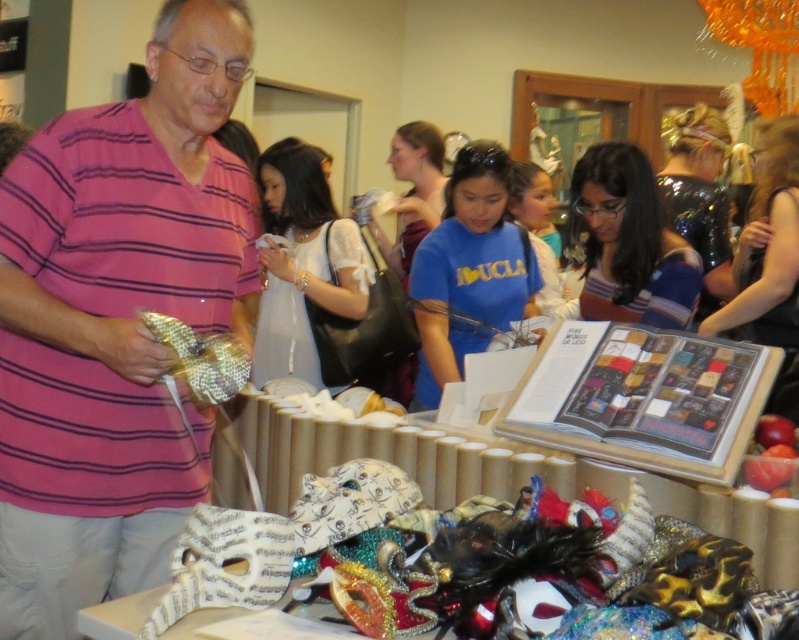
Can you confirm if blue matte t-shirt at center is taller than striped fabric shirt at center?

Indeed, blue matte t-shirt at center has a greater height compared to striped fabric shirt at center.

Find the location of a particular element. The image size is (799, 640). blue matte t-shirt at center is located at coordinates (468, 272).

Image resolution: width=799 pixels, height=640 pixels. In order to click on blue matte t-shirt at center in this screenshot , I will do `click(468, 272)`.

Is white lace dress at center to the right of striped fabric shirt at center from the viewer's perspective?

Incorrect, white lace dress at center is not on the right side of striped fabric shirt at center.

Is white lace dress at center further to the viewer compared to striped fabric shirt at center?

Yes, white lace dress at center is behind striped fabric shirt at center.

Is point (356, 260) positioned after point (625, 314)?

Yes, point (356, 260) is farther from viewer.

The height and width of the screenshot is (640, 799). Identify the location of white lace dress at center. [x=301, y=264].

Is pink striped shirt at center thinner than white lace dress at center?

Yes.

Image resolution: width=799 pixels, height=640 pixels. Identify the location of pink striped shirt at center. (116, 321).

Locate an element on the screen. This screenshot has height=640, width=799. pink striped shirt at center is located at coordinates (116, 321).